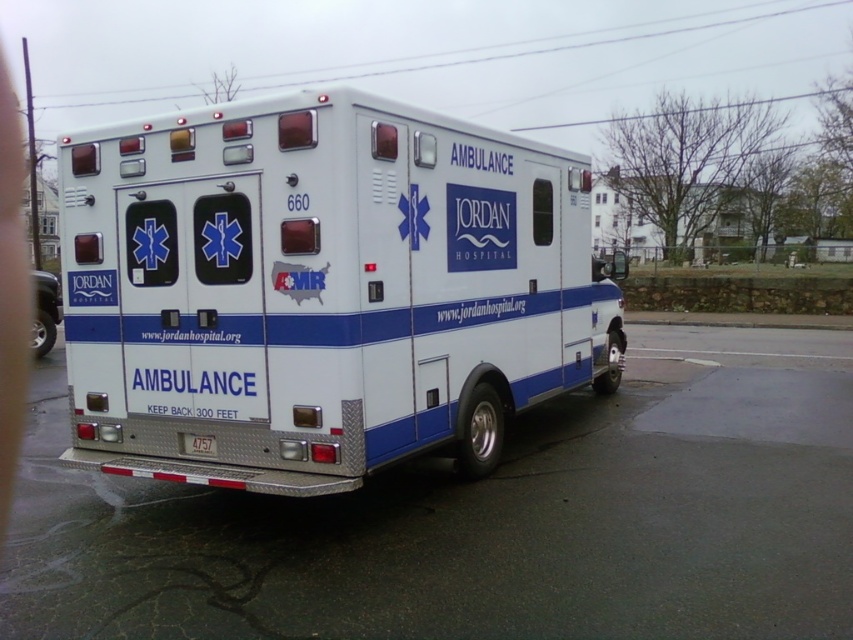
Question: Is white glossy ambulance at center below white plastic license plate at rear?

Choices:
 (A) yes
 (B) no

Answer: (B)

Question: Estimate the real-world distances between objects in this image. Which object is farther from the white glossy ambulance at center?

Choices:
 (A) white plastic license plate at rear
 (B) white metallic ambulance at center

Answer: (B)

Question: Which point is farther to the camera?

Choices:
 (A) white plastic license plate at rear
 (B) white glossy ambulance at center
 (C) white metallic ambulance at center

Answer: (B)

Question: Is white glossy ambulance at center further to camera compared to white plastic license plate at rear?

Choices:
 (A) no
 (B) yes

Answer: (B)

Question: Is white metallic ambulance at center to the right of white plastic license plate at rear from the viewer's perspective?

Choices:
 (A) no
 (B) yes

Answer: (B)

Question: Which point appears closest to the camera in this image?

Choices:
 (A) (184, 445)
 (B) (49, 305)

Answer: (A)